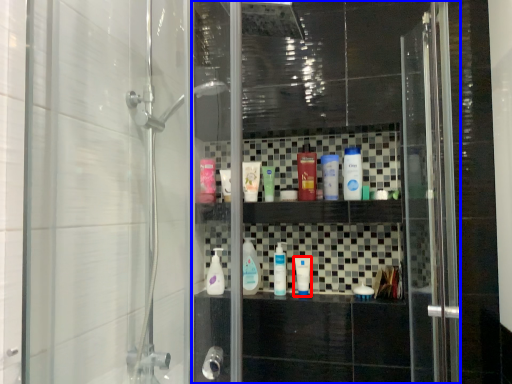
Question: Which object is closer to the camera taking this photo, toiletry (highlighted by a red box) or screen door (highlighted by a blue box)?

Choices:
 (A) toiletry
 (B) screen door

Answer: (B)